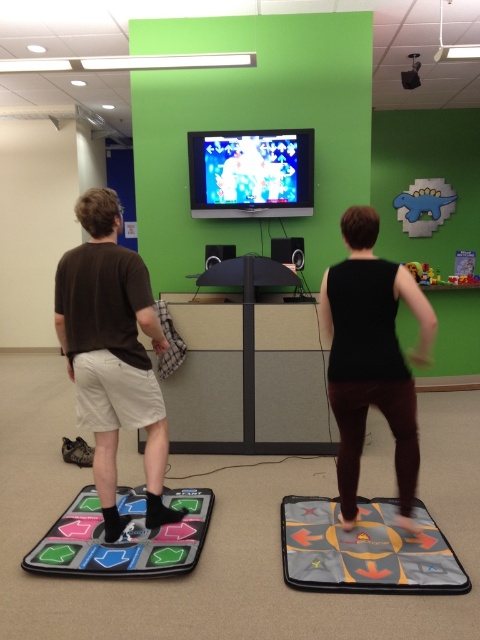
Which of these two, gray rubber dance pad at lower right or shiny plastic tv at upper center, stands taller?

With more height is shiny plastic tv at upper center.

Based on the photo, can you confirm if gray rubber dance pad at lower right is thinner than shiny plastic tv at upper center?

Yes.

Which is behind, point (327, 580) or point (194, 156)?

The point (194, 156) is more distant.

I want to click on gray rubber dance pad at lower right, so click(x=365, y=548).

Is point (394, 403) less distant than point (330, 540)?

Yes.

Identify the location of black matte tank top at center. (372, 356).

The width and height of the screenshot is (480, 640). What are the coordinates of `black matte tank top at center` in the screenshot? It's located at (372, 356).

Find the location of a particular element. black matte tank top at center is located at coordinates (372, 356).

Identify the location of brown cotton t-shirt at left. (112, 353).

Can you confirm if brown cotton t-shirt at left is positioned to the right of black matte tank top at center?

No, brown cotton t-shirt at left is not to the right of black matte tank top at center.

Does point (60, 284) come farther from viewer compared to point (348, 284)?

Yes, it is.

Locate an element on the screen. brown cotton t-shirt at left is located at coordinates (112, 353).